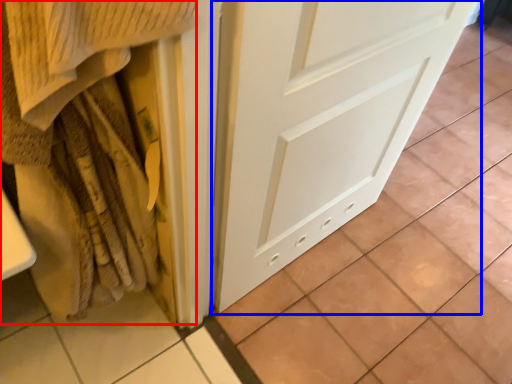
Question: Which of the following is the farthest to the observer, blanket (highlighted by a red box) or door (highlighted by a blue box)?

Choices:
 (A) blanket
 (B) door

Answer: (B)